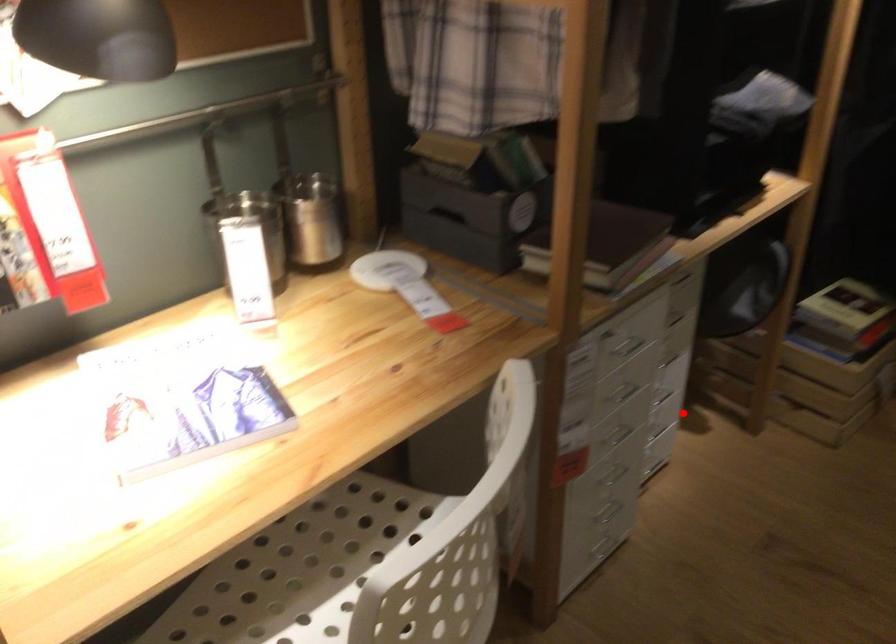
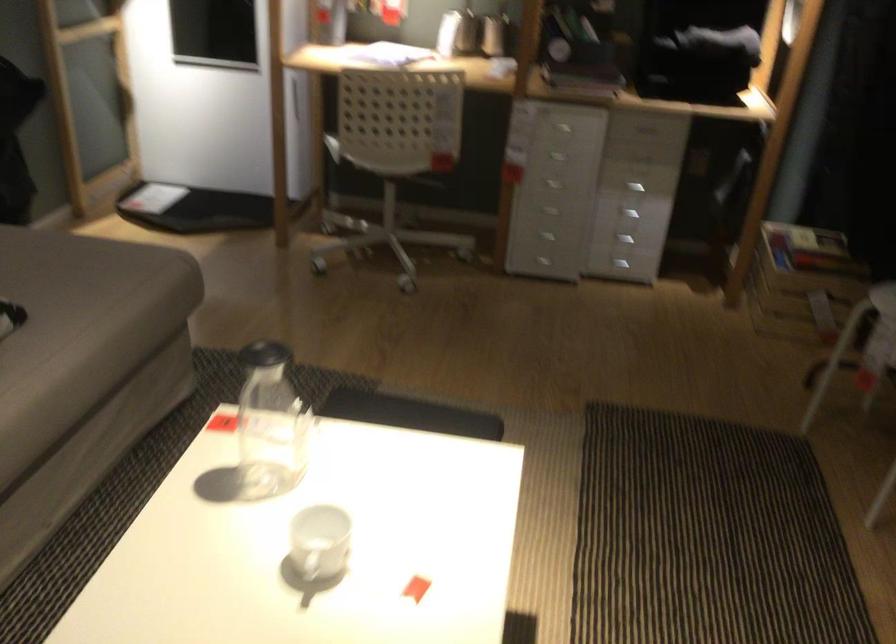
Find the pixel in the second image that matches the highlighted location in the first image.

(627, 214)